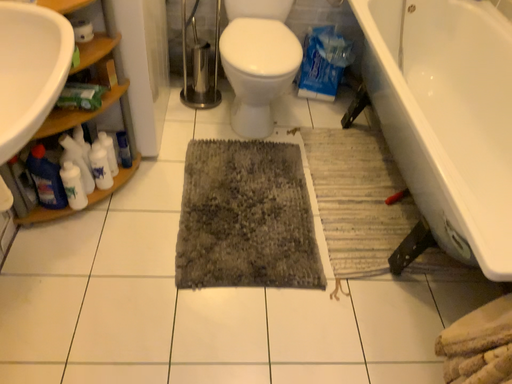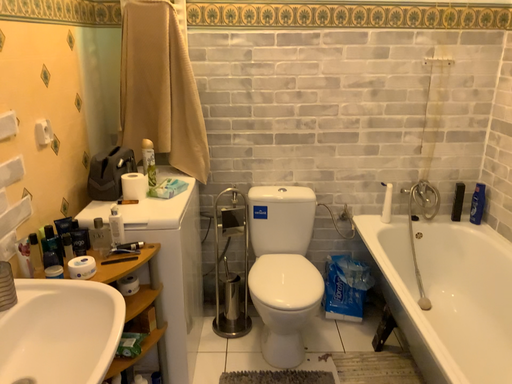
Question: Which way did the camera rotate in the video?

Choices:
 (A) rotated downward
 (B) rotated upward

Answer: (B)